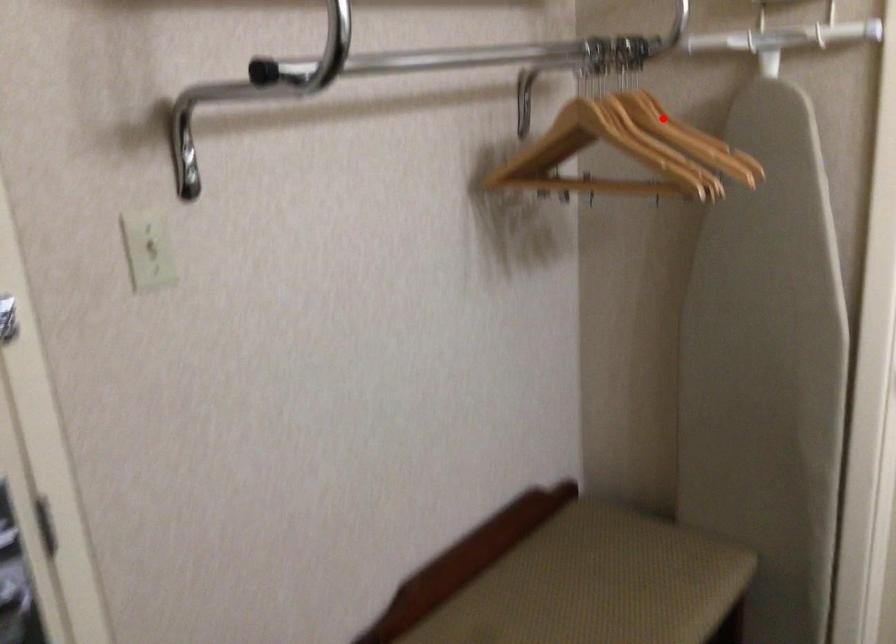
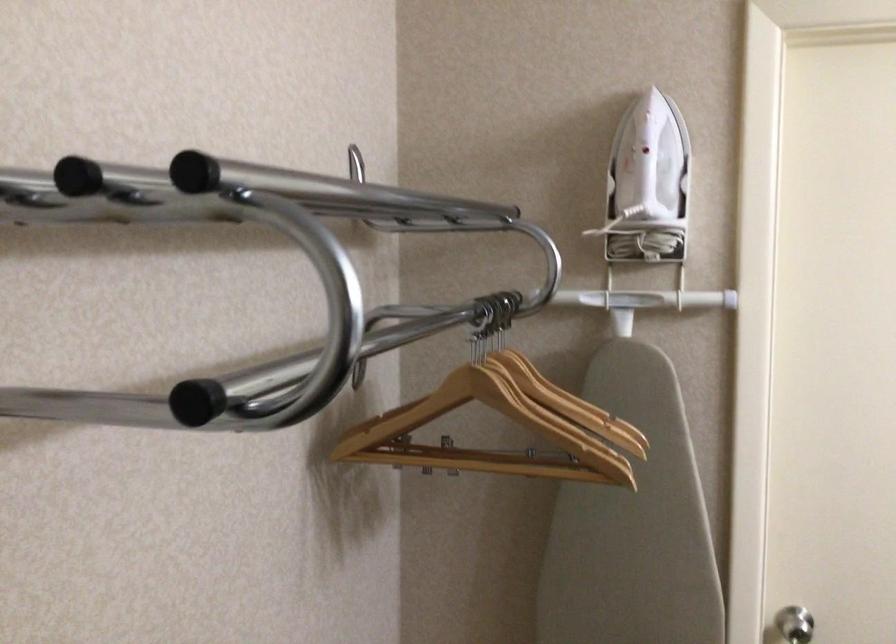
Question: I am providing you with two images of the same scene from different viewpoints. In image1, a red point is highlighted. Considering the same 3D point in image2, which of the following is correct?

Choices:
 (A) It is closer
 (B) It is farther

Answer: (A)